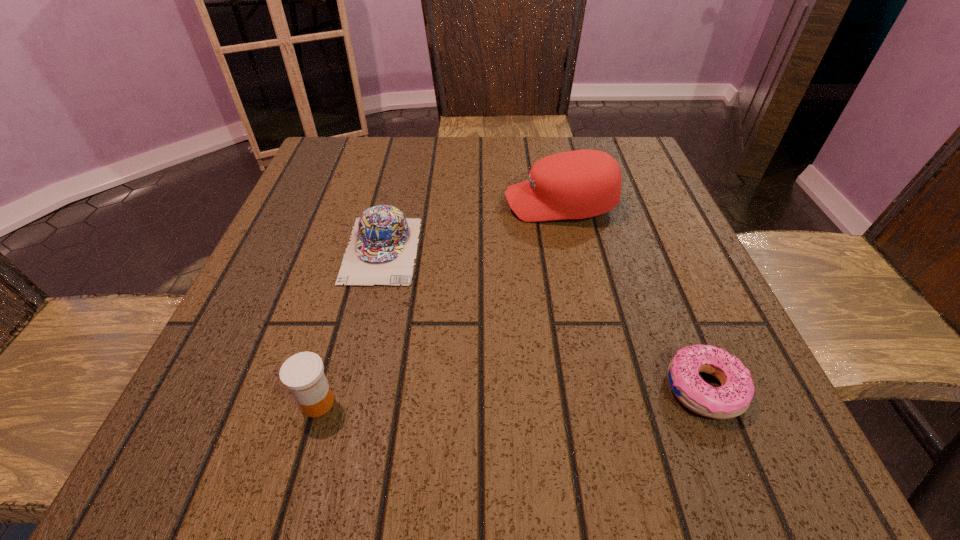
You are a GUI agent. You are given a task and a screenshot of the screen. Output one action in this format:
    pyautogui.click(x=<x>, y=<y>)
    Task: Click on the object at the far right corner
    The image size is (960, 540).
    Given the screenshot: What is the action you would take?
    pyautogui.click(x=579, y=184)

Identify the location of object present at the near right corner. (733, 398).

I want to click on vacant space at the far edge of the desktop, so click(562, 136).

The width and height of the screenshot is (960, 540). In order to click on vacant region at the near edge in this screenshot , I will do `click(564, 452)`.

Where is `vacant space at the left edge`? The image size is (960, 540). vacant space at the left edge is located at coordinates (343, 264).

In the image, there is a desktop. In order to click on vacant space at the right edge in this screenshot , I will do `click(641, 349)`.

Find the location of a particular element. vacant region at the far left corner of the desktop is located at coordinates (311, 170).

This screenshot has width=960, height=540. In order to click on free space at the far right corner of the desktop in this screenshot , I will do `click(620, 141)`.

The width and height of the screenshot is (960, 540). Find the location of `vacant position at the near right corner of the desktop`. vacant position at the near right corner of the desktop is located at coordinates (711, 448).

Where is `vacant region between the taller cap and the medicine`? The image size is (960, 540). vacant region between the taller cap and the medicine is located at coordinates (439, 303).